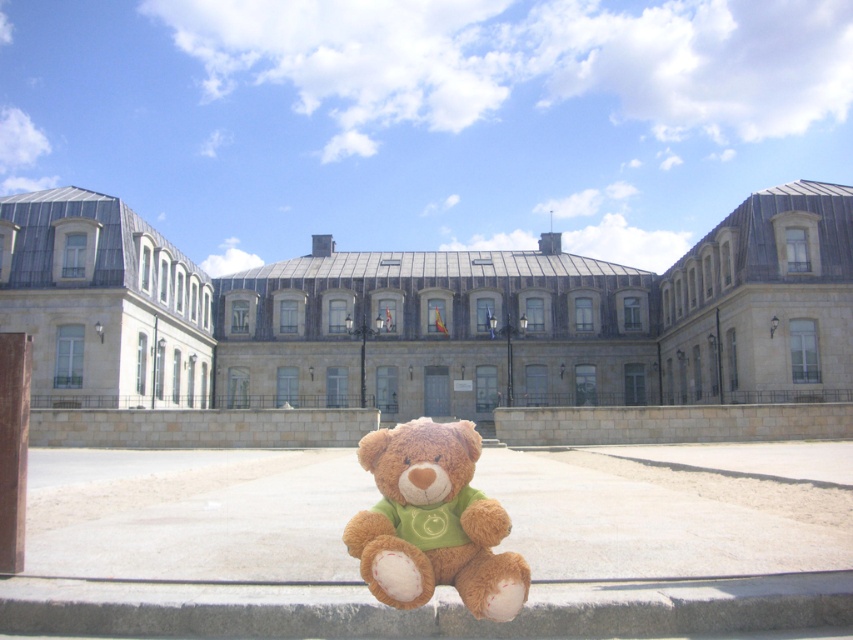
Between stone building at center and soft brown teddy bear at center, which one is positioned lower?

Positioned lower is soft brown teddy bear at center.

Does stone building at center appear over soft brown teddy bear at center?

Yes.

Locate an element on the screen. stone building at center is located at coordinates (454, 316).